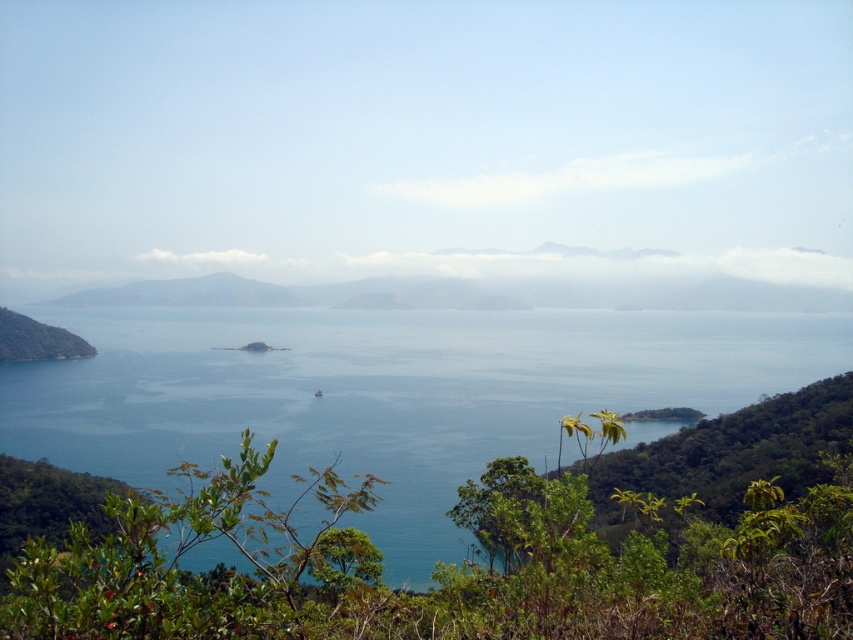
Which is above, blue water at center or green leafy hillside at left?

green leafy hillside at left is above.

Who is lower down, blue water at center or green leafy hillside at left?

blue water at center

Is point (315, 316) positioned after point (85, 353)?

No, it is not.

The width and height of the screenshot is (853, 640). Find the location of `blue water at center`. blue water at center is located at coordinates (386, 394).